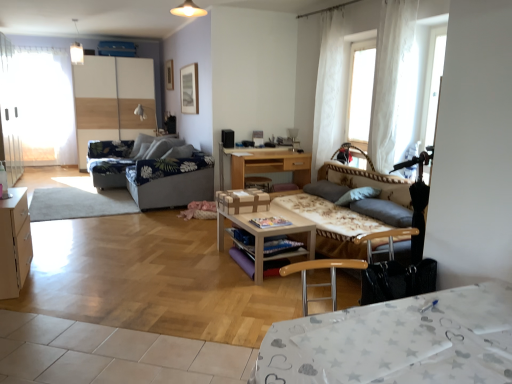
Measure the distance between floral fabric studio couch at center, the 2th studio couch from the left, and camera.

The distance of floral fabric studio couch at center, the 2th studio couch from the left, from camera is 3.35 meters.

How much space does blue floral fabric studio couch at center-left, which is the 2th studio couch in front-to-back order, occupy horizontally?

blue floral fabric studio couch at center-left, which is the 2th studio couch in front-to-back order, is 1.04 meters wide.

Describe the element at coordinates (161, 175) in the screenshot. This screenshot has width=512, height=384. I see `blue floral fabric studio couch at center-left, which is counted as the 1th studio couch, starting from the left` at that location.

Locate an element on the screen. wooden table at center, the second table viewed from the top is located at coordinates (268, 233).

Find the location of `velvet gray cushion at right`. velvet gray cushion at right is located at coordinates (384, 211).

What is the approximate width of white glossy dresser at left?

white glossy dresser at left is 27.03 inches wide.

Identify the location of floral fabric studio couch at center, which is the 2th studio couch in back-to-front order. This screenshot has width=512, height=384. (378, 202).

Measure the distance between white glossy table at lower right and white sheer curtain at upper right, which is the 2th curtain in left-to-right order.

white glossy table at lower right and white sheer curtain at upper right, which is the 2th curtain in left-to-right order, are 2.82 meters apart.

Based on the photo, is white glossy table at lower right at the left side of white sheer curtain at upper right, the first curtain in the front-to-back sequence?

Yes, white glossy table at lower right is to the left of white sheer curtain at upper right, the first curtain in the front-to-back sequence.

Find the location of a particular element. This screenshot has height=384, width=512. the 1st curtain behind when counting from the white glossy table at lower right is located at coordinates (389, 77).

Considering the sizes of floral fabric studio couch at center, the 2th studio couch from the left, and blue floral fabric studio couch at center-left, which is the 2th studio couch in front-to-back order, in the image, is floral fabric studio couch at center, the 2th studio couch from the left, bigger or smaller than blue floral fabric studio couch at center-left, which is the 2th studio couch in front-to-back order,?

Considering their sizes, floral fabric studio couch at center, the 2th studio couch from the left, takes up more space than blue floral fabric studio couch at center-left, which is the 2th studio couch in front-to-back order.

Is floral fabric studio couch at center, which appears as the 1th studio couch when viewed from the front, behind blue floral fabric studio couch at center-left, marked as the 1th studio couch in a back-to-front arrangement?

No.

Can you tell me how much floral fabric studio couch at center, the 2th studio couch from the left, and blue floral fabric studio couch at center-left, which is the 2th studio couch in front-to-back order, differ in facing direction?

There is a 2.85-degree angle between the facing directions of floral fabric studio couch at center, the 2th studio couch from the left, and blue floral fabric studio couch at center-left, which is the 2th studio couch in front-to-back order.

Does floral fabric studio couch at center, which appears as the 1th studio couch when viewed from the right, have a lesser height compared to blue floral fabric studio couch at center-left, which is counted as the 1th studio couch, starting from the left?

Correct, floral fabric studio couch at center, which appears as the 1th studio couch when viewed from the right, is not as tall as blue floral fabric studio couch at center-left, which is counted as the 1th studio couch, starting from the left.

Considering the positions of objects light wood cabinet at left and wooden picture frame at upper center in the image provided, who is in front, light wood cabinet at left or wooden picture frame at upper center?

light wood cabinet at left is more forward.

Looking at their sizes, would you say light wood cabinet at left is wider or thinner than wooden picture frame at upper center?

light wood cabinet at left is wider than wooden picture frame at upper center.

From the image's perspective, does light wood cabinet at left appear higher than wooden picture frame at upper center?

Actually, light wood cabinet at left appears below wooden picture frame at upper center in the image.

Are wooden desk at center, which is counted as the 2th table, starting from the bottom, and white sheer curtain at upper right, the second curtain positioned from the front, far apart?

No, wooden desk at center, which is counted as the 2th table, starting from the bottom, is in close proximity to white sheer curtain at upper right, the second curtain positioned from the front.

From the image's perspective, is wooden desk at center, the first table positioned from the back, located above white sheer curtain at upper right, arranged as the first curtain when viewed from the left?

Actually, wooden desk at center, the first table positioned from the back, appears below white sheer curtain at upper right, arranged as the first curtain when viewed from the left, in the image.

From a real-world perspective, is wooden desk at center, which is counted as the 2th table, starting from the bottom, under white sheer curtain at upper right, the second curtain positioned from the front?

Yes.

Consider the image. Does white glossy table at lower right lie behind floral fabric studio couch at center, which is the 2th studio couch in back-to-front order?

No, white glossy table at lower right is closer to the viewer.

Is white glossy table at lower right facing towards floral fabric studio couch at center, which appears as the 1th studio couch when viewed from the front?

Yes, white glossy table at lower right is facing floral fabric studio couch at center, which appears as the 1th studio couch when viewed from the front.

I want to click on desk on the left side of floral fabric studio couch at center, which appears as the 1th studio couch when viewed from the front, so click(397, 342).

Considering the positions of point (377, 315) and point (262, 281), is point (377, 315) closer or farther from the camera than point (262, 281)?

Point (377, 315) appears to be closer to the viewer than point (262, 281).

How many degrees apart are the facing directions of white glossy table at lower right and wooden table at center, the second table positioned from the back?

They differ by 94.6 degrees in their facing directions.

Is the position of white glossy table at lower right less distant than that of wooden table at center, the second table viewed from the top?

Yes, it is.

Between white glossy table at lower right and wooden table at center, which ranks as the 1th table in front-to-back order, which one appears on the right side from the viewer's perspective?

white glossy table at lower right is more to the right.

From the image's perspective, relative to floral fabric studio couch at center, which appears as the 1th studio couch when viewed from the front, is light wood cabinet at left above or below?

From the image's perspective, light wood cabinet at left appears below floral fabric studio couch at center, which appears as the 1th studio couch when viewed from the front.

Does light wood cabinet at left appear on the right side of floral fabric studio couch at center, which appears as the 1th studio couch when viewed from the right?

No.

Find the location of a particular element. The height and width of the screenshot is (384, 512). the 1st studio couch behind the light wood cabinet at left, starting your count from the anchor is located at coordinates (378, 202).

The height and width of the screenshot is (384, 512). There is a white glossy table at lower right. Find the location of `the 2nd curtain above it (from a real-world perspective)`. the 2nd curtain above it (from a real-world perspective) is located at coordinates (389, 77).

At what (x,y) coordinates should I click in order to perform the action: click on studio couch below the blue floral fabric studio couch at center-left, which appears as the 2th studio couch when viewed from the right (from the image's perspective). Please return your answer as a coordinate pair (x, y). Looking at the image, I should click on (378, 202).

Looking at the image, which one is located closer to floral fabric studio couch at center, which appears as the 1th studio couch when viewed from the right, wooden picture frame at upper center or velvet gray cushion at right?

velvet gray cushion at right.

From the image, which object appears to be nearer to white glossy table at lower right, white sheer curtain at upper right, which is the 1th curtain from back to front, or floral fabric studio couch at center, which is the 2th studio couch in back-to-front order?

The object closer to white glossy table at lower right is floral fabric studio couch at center, which is the 2th studio couch in back-to-front order.

Which object lies further to the anchor point white glossy table at lower right, white sheer curtain at upper right, the first curtain in the front-to-back sequence, or wooden table at center, the first table ordered from the bottom?

white sheer curtain at upper right, the first curtain in the front-to-back sequence, is positioned further to the anchor white glossy table at lower right.

Looking at the image, which one is located closer to floral fabric studio couch at center, which appears as the 1th studio couch when viewed from the front, wooden table at center, the second table viewed from the top, or light wood cabinet at left?

Among the two, wooden table at center, the second table viewed from the top, is located nearer to floral fabric studio couch at center, which appears as the 1th studio couch when viewed from the front.

Which object lies further to the anchor point white glossy table at lower right, wooden desk at center, which is counted as the 2th table, starting from the bottom, or wooden table at center, which ranks as the 1th table in front-to-back order?

Based on the image, wooden desk at center, which is counted as the 2th table, starting from the bottom, appears to be further to white glossy table at lower right.

Estimate the real-world distances between objects in this image. Which object is closer to blue floral fabric studio couch at center-left, which is the 2th studio couch in front-to-back order, wooden desk at center, the 2th table in the front-to-back sequence, or wooden table at center, the second table positioned from the back?

wooden desk at center, the 2th table in the front-to-back sequence, is closer to blue floral fabric studio couch at center-left, which is the 2th studio couch in front-to-back order.

Which object lies nearer to the anchor point blue floral fabric studio couch at center-left, which appears as the 2th studio couch when viewed from the right, wooden desk at center, which is counted as the 2th table, starting from the bottom, or floral fabric studio couch at center, the 2th studio couch from the left?

The object closer to blue floral fabric studio couch at center-left, which appears as the 2th studio couch when viewed from the right, is wooden desk at center, which is counted as the 2th table, starting from the bottom.

Which object lies further to the anchor point white sheer curtain at upper right, the first curtain in the front-to-back sequence, wooden desk at center, which is counted as the 2th table, starting from the bottom, or white glossy dresser at left?

Based on the image, white glossy dresser at left appears to be further to white sheer curtain at upper right, the first curtain in the front-to-back sequence.

Locate an element on the screen. The height and width of the screenshot is (384, 512). table located between wooden table at center, the second table viewed from the top, and blue floral fabric studio couch at center-left, which is the 2th studio couch in front-to-back order, in the depth direction is located at coordinates (264, 164).

Locate an element on the screen. The height and width of the screenshot is (384, 512). studio couch between light wood cabinet at left and floral fabric studio couch at center, which appears as the 1th studio couch when viewed from the front, in the horizontal direction is located at coordinates (161, 175).

At what (x,y) coordinates should I click in order to perform the action: click on studio couch positioned between wooden desk at center, the 1th table in the top-to-bottom sequence, and wooden picture frame at upper center from near to far. Please return your answer as a coordinate pair (x, y). Looking at the image, I should click on (161, 175).

Find the location of a particular element. The height and width of the screenshot is (384, 512). picture frame between wooden table at center, the first table ordered from the bottom, and white glossy dresser at left, along the z-axis is located at coordinates (169, 75).